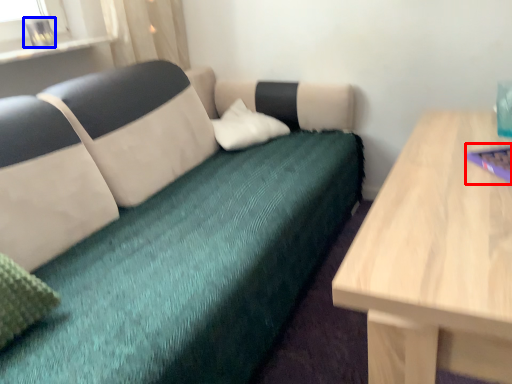
Question: Which point is further to the camera, laptop (highlighted by a red box) or glass vase (highlighted by a blue box)?

Choices:
 (A) laptop
 (B) glass vase

Answer: (B)